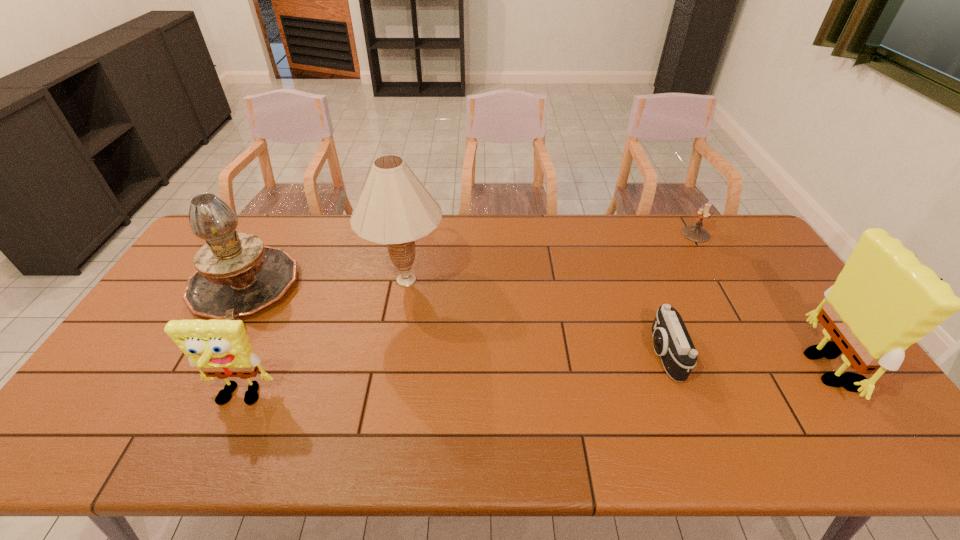
Find the location of a particular element. This screenshot has width=960, height=540. free space between the oil lamp and the farthest object is located at coordinates (469, 261).

Select which object is the fourth closest to the lampshade. Please provide its 2D coordinates. Your answer should be formatted as a tuple, i.e. [(x, y)], where the tuple contains the x and y coordinates of a point satisfying the conditions above.

[(694, 233)]

Identify which object is the fifth closest to the rightmost object. Please provide its 2D coordinates. Your answer should be formatted as a tuple, i.e. [(x, y)], where the tuple contains the x and y coordinates of a point satisfying the conditions above.

[(237, 275)]

Find the location of `vacant space that satisfies the following two spatial constraints: 1. on the back side of the lampshade; 2. on the right side of the fourth shortest object`. vacant space that satisfies the following two spatial constraints: 1. on the back side of the lampshade; 2. on the right side of the fourth shortest object is located at coordinates (248, 280).

Find the location of a particular element. This screenshot has height=540, width=960. free point that satisfies the following two spatial constraints: 1. on the front lens of the shortest object; 2. on the face of the left sponge is located at coordinates (681, 398).